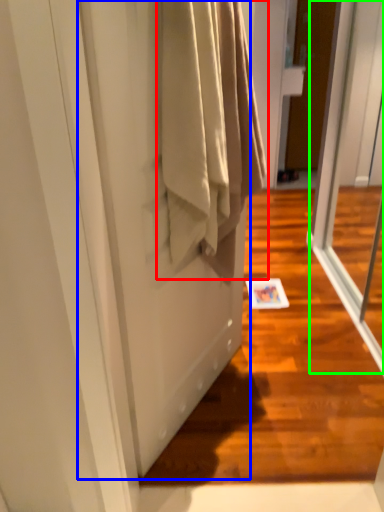
Question: Which object is positioned closest to clothing (highlighted by a red box)? Select from screen door (highlighted by a blue box) and screen door (highlighted by a green box).

Choices:
 (A) screen door
 (B) screen door

Answer: (A)